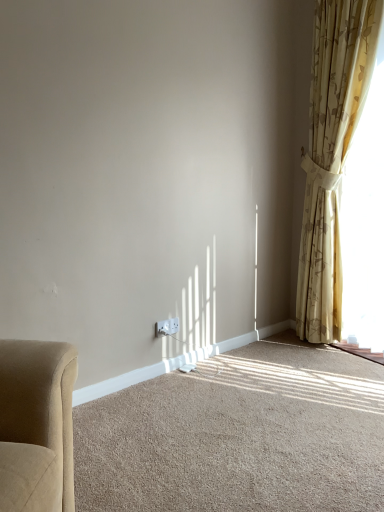
Question: Is white plastic electric outlet at lower center wider than beige carpet at lower center?

Choices:
 (A) no
 (B) yes

Answer: (A)

Question: Is white plastic electric outlet at lower center not inside beige carpet at lower center?

Choices:
 (A) yes
 (B) no

Answer: (A)

Question: From a real-world perspective, is white plastic electric outlet at lower center beneath beige carpet at lower center?

Choices:
 (A) no
 (B) yes

Answer: (A)

Question: From a real-world perspective, does white plastic electric outlet at lower center stand above beige carpet at lower center?

Choices:
 (A) yes
 (B) no

Answer: (A)

Question: From the image's perspective, is white plastic electric outlet at lower center located above beige carpet at lower center?

Choices:
 (A) yes
 (B) no

Answer: (A)

Question: Is beige carpet at lower center inside or outside of white plastic electric outlet at lower center?

Choices:
 (A) inside
 (B) outside

Answer: (B)

Question: Visually, is beige carpet at lower center positioned to the left or to the right of white plastic electric outlet at lower center?

Choices:
 (A) right
 (B) left

Answer: (A)

Question: From the image's perspective, is beige carpet at lower center above or below white plastic electric outlet at lower center?

Choices:
 (A) above
 (B) below

Answer: (B)

Question: Considering the positions of beige carpet at lower center and white plastic electric outlet at lower center in the image, is beige carpet at lower center taller or shorter than white plastic electric outlet at lower center?

Choices:
 (A) short
 (B) tall

Answer: (A)

Question: In terms of height, does white plastic electric outlet at lower center look taller or shorter compared to beige carpet at lower center?

Choices:
 (A) short
 (B) tall

Answer: (B)

Question: From a real-world perspective, is white plastic electric outlet at lower center physically located above or below beige carpet at lower center?

Choices:
 (A) below
 (B) above

Answer: (B)

Question: In terms of width, does white plastic electric outlet at lower center look wider or thinner when compared to beige carpet at lower center?

Choices:
 (A) wide
 (B) thin

Answer: (B)

Question: Is white plastic electric outlet at lower center in front of or behind beige carpet at lower center in the image?

Choices:
 (A) front
 (B) behind

Answer: (B)

Question: In terms of width, does white plastic electric outlet at lower center look wider or thinner when compared to yellow floral curtain at right?

Choices:
 (A) thin
 (B) wide

Answer: (A)

Question: Is white plastic electric outlet at lower center in front of or behind yellow floral curtain at right in the image?

Choices:
 (A) behind
 (B) front

Answer: (A)